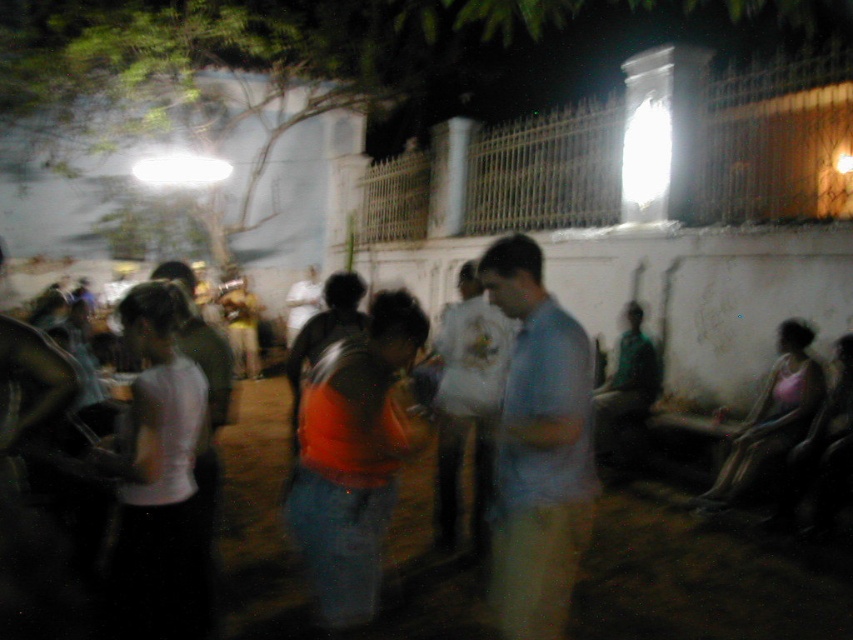
Question: Which object is the closest to the white matte bag at center?

Choices:
 (A) orange fabric shirt at center
 (B) light blue fabric shirt at center

Answer: (B)

Question: Is light blue fabric shirt at center to the right of white matte bag at center from the viewer's perspective?

Choices:
 (A) no
 (B) yes

Answer: (B)

Question: Does orange fabric shirt at center appear under white matte bag at center?

Choices:
 (A) no
 (B) yes

Answer: (B)

Question: Which object appears farthest from the camera in this image?

Choices:
 (A) white matte bag at center
 (B) light blue fabric shirt at center

Answer: (A)

Question: Which of the following is the closest to the observer?

Choices:
 (A) (471, 534)
 (B) (756, 621)

Answer: (B)

Question: Is orange fabric shirt at center positioned before white matte bag at center?

Choices:
 (A) no
 (B) yes

Answer: (B)